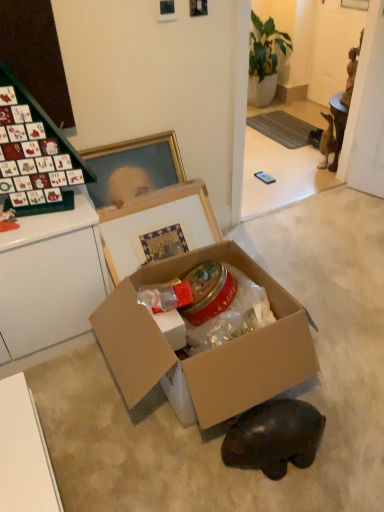
Question: Is green glossy plant at upper center wider than brown matte figurine at right, which is the first animal from right to left?

Choices:
 (A) no
 (B) yes

Answer: (B)

Question: Are green glossy plant at upper center and brown matte figurine at right, the 2th animal positioned from the bottom, making contact?

Choices:
 (A) no
 (B) yes

Answer: (A)

Question: Does green glossy plant at upper center have a smaller size compared to brown matte figurine at right, which is the 2th animal from left to right?

Choices:
 (A) no
 (B) yes

Answer: (A)

Question: Is green glossy plant at upper center in front of brown matte figurine at right, the second animal viewed from the front?

Choices:
 (A) yes
 (B) no

Answer: (B)

Question: Is green glossy plant at upper center facing away from brown matte figurine at right, which is the first animal from right to left?

Choices:
 (A) no
 (B) yes

Answer: (A)

Question: From the image's perspective, is green glossy plant at upper center located beneath brown matte figurine at right, which is the first animal from right to left?

Choices:
 (A) no
 (B) yes

Answer: (A)

Question: Considering the relative sizes of green glossy plant at upper center and cardboard box at center in the image provided, is green glossy plant at upper center bigger than cardboard box at center?

Choices:
 (A) yes
 (B) no

Answer: (A)

Question: Does green glossy plant at upper center appear on the right side of cardboard box at center?

Choices:
 (A) no
 (B) yes

Answer: (B)

Question: Can you confirm if green glossy plant at upper center is smaller than cardboard box at center?

Choices:
 (A) no
 (B) yes

Answer: (A)

Question: Is green glossy plant at upper center facing towards cardboard box at center?

Choices:
 (A) no
 (B) yes

Answer: (A)

Question: Is green glossy plant at upper center not near cardboard box at center?

Choices:
 (A) yes
 (B) no

Answer: (A)

Question: Considering the relative sizes of green glossy plant at upper center and cardboard box at center in the image provided, is green glossy plant at upper center shorter than cardboard box at center?

Choices:
 (A) yes
 (B) no

Answer: (B)

Question: Is cardboard box at center surrounding cardboard box at center?

Choices:
 (A) yes
 (B) no

Answer: (B)